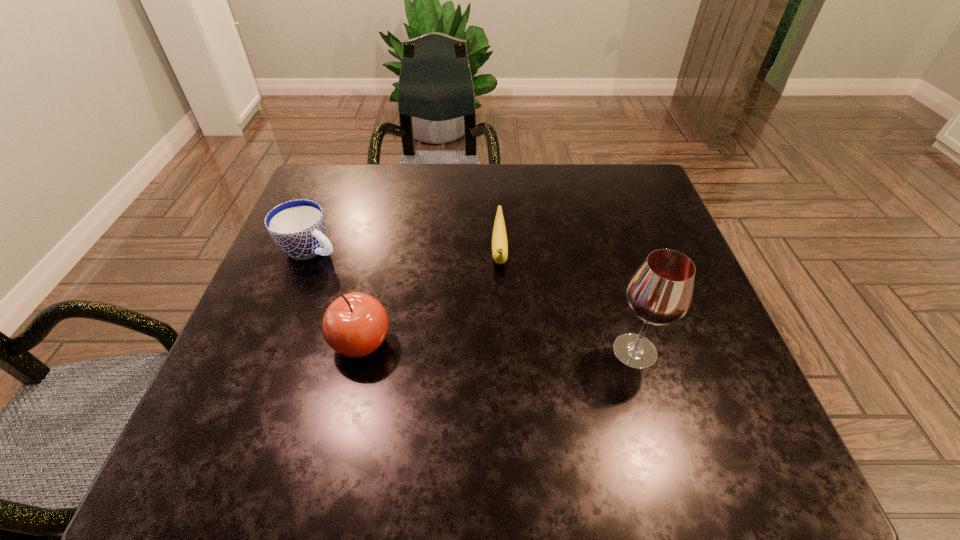
What are the coordinates of `vacant spot on the desktop that is between the second object from left to right and the rightmost object and is positioned at the stem of the banana` in the screenshot? It's located at (502, 347).

This screenshot has height=540, width=960. Find the location of `free space on the desktop that is between the third shortest object and the rightmost object and is positioned on the side of the leftmost object with the handle`. free space on the desktop that is between the third shortest object and the rightmost object and is positioned on the side of the leftmost object with the handle is located at coordinates (503, 347).